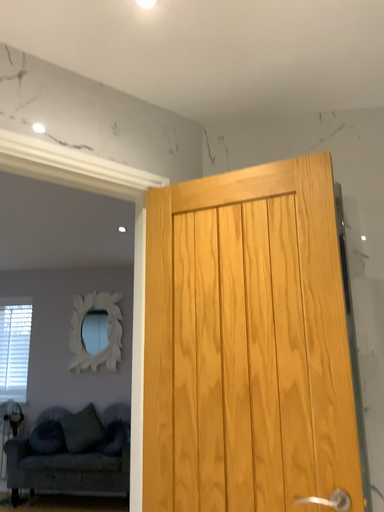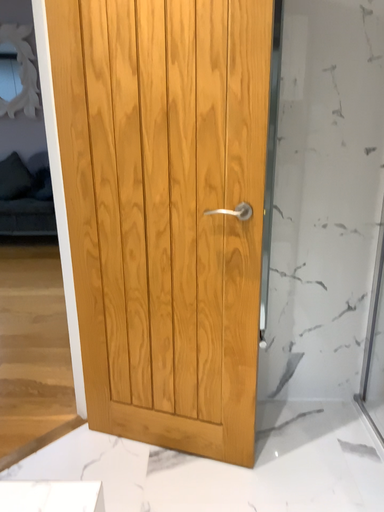
Question: Which way did the camera rotate in the video?

Choices:
 (A) rotated right
 (B) rotated left

Answer: (A)